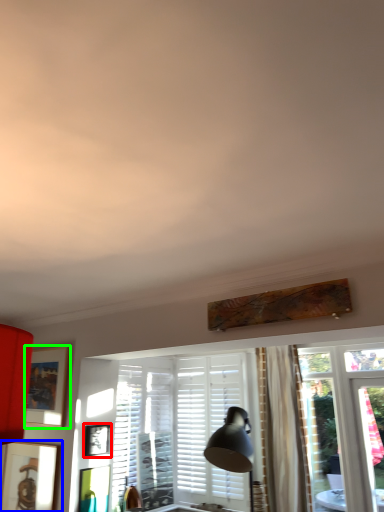
Question: Which object is positioned farthest from picture frame (highlighted by a red box)? Select from picture frame (highlighted by a blue box) and picture frame (highlighted by a green box).

Choices:
 (A) picture frame
 (B) picture frame

Answer: (A)